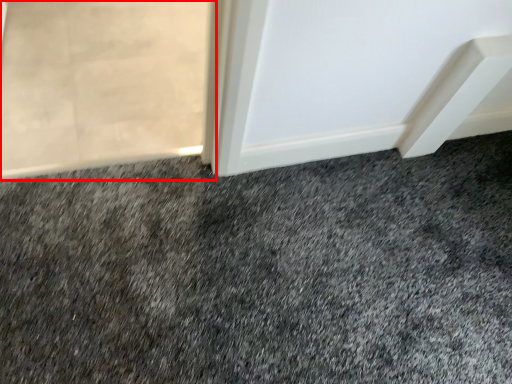
Question: From the image's perspective, considering the relative positions of screen door (annotated by the red box) and granite in the image provided, where is screen door (annotated by the red box) located with respect to the staircase?

Choices:
 (A) above
 (B) below

Answer: (A)